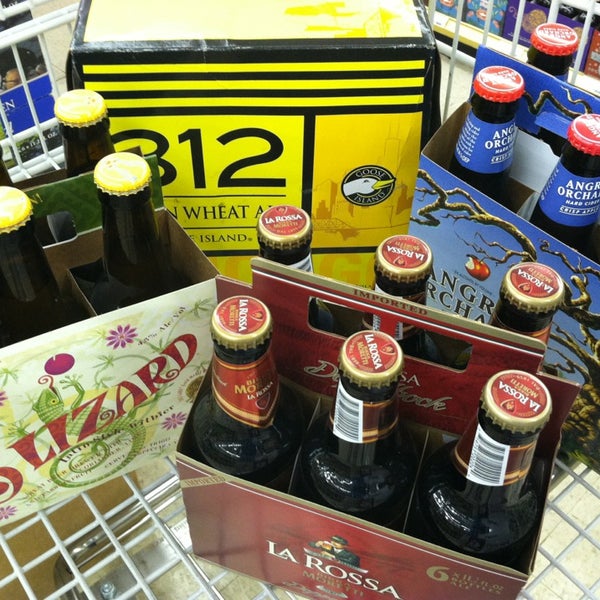
Where is `shelf in background`? The height and width of the screenshot is (600, 600). shelf in background is located at coordinates (473, 16).